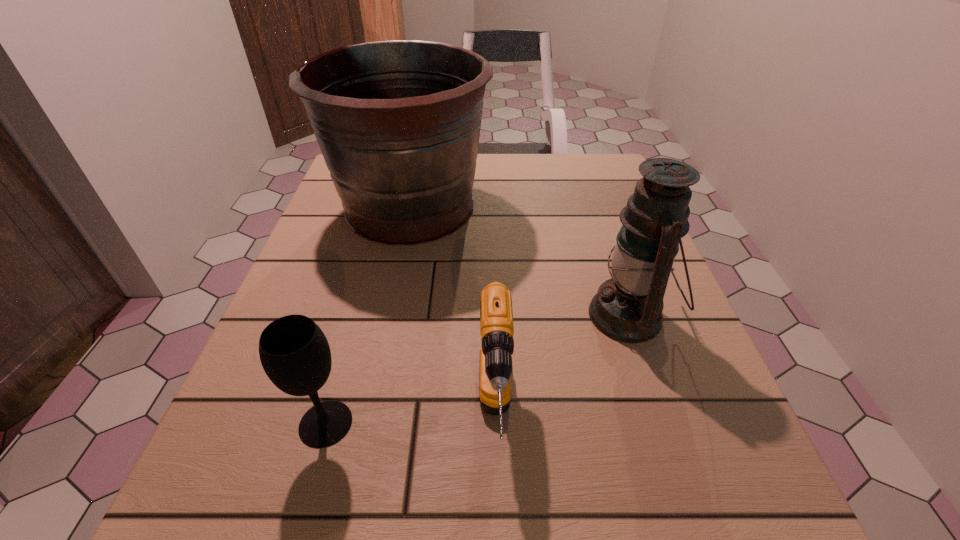
Image resolution: width=960 pixels, height=540 pixels. What are the coordinates of `empty space between the wineglass and the bucket` in the screenshot? It's located at (368, 315).

Image resolution: width=960 pixels, height=540 pixels. Identify the location of empty space that is in between the wineglass and the drill. (411, 421).

I want to click on free space between the oil lamp and the drill, so click(x=563, y=367).

Locate an element on the screen. This screenshot has height=540, width=960. blank region between the wineglass and the farthest object is located at coordinates (368, 315).

The width and height of the screenshot is (960, 540). Find the location of `vacant area that lies between the drill and the farthest object`. vacant area that lies between the drill and the farthest object is located at coordinates (452, 313).

Where is `empty location between the wineglass and the farthest object`? The height and width of the screenshot is (540, 960). empty location between the wineglass and the farthest object is located at coordinates (368, 315).

The height and width of the screenshot is (540, 960). What are the coordinates of `blank region between the rightmost object and the wineglass` in the screenshot? It's located at (477, 370).

The image size is (960, 540). What are the coordinates of `empty space between the rightmost object and the farthest object` in the screenshot? It's located at (519, 261).

At what (x,y) coordinates should I click in order to perform the action: click on object that is the third closest one to the wineglass. Please return your answer as a coordinate pair (x, y). Looking at the image, I should click on (628, 307).

Locate an element on the screen. object identified as the closest to the wineglass is located at coordinates (496, 315).